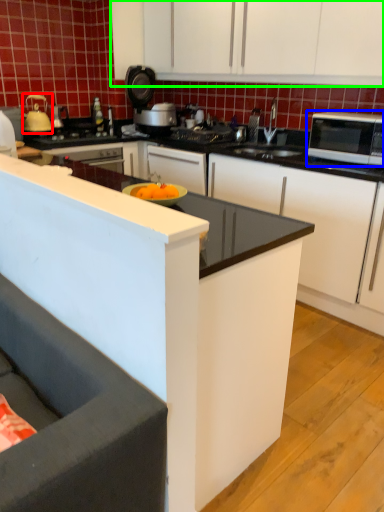
Question: Which object is the closest to the tea pot (highlighted by a red box)? Choose among these: microwave oven (highlighted by a blue box) or cabinetry (highlighted by a green box).

Choices:
 (A) microwave oven
 (B) cabinetry

Answer: (B)